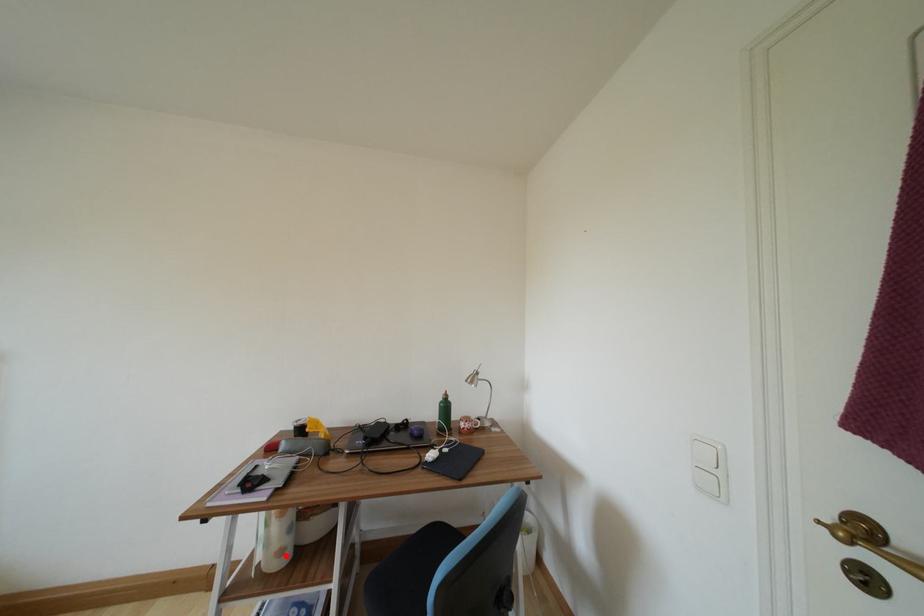
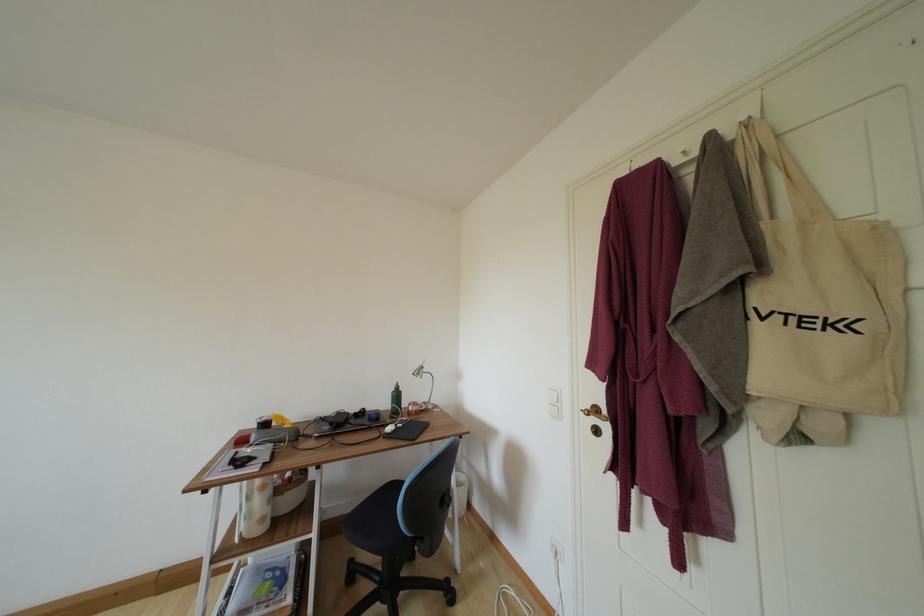
Locate, in the second image, the point that corresponds to the highlighted location in the first image.

(266, 524)